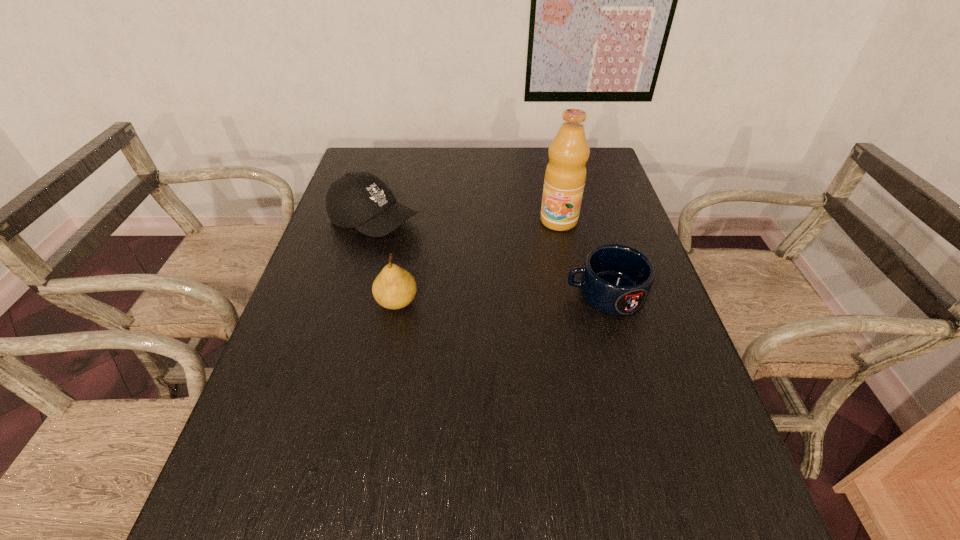
Image resolution: width=960 pixels, height=540 pixels. Identify the location of free space between the shortest object and the baseball cap. (490, 258).

Point out which object is positioned as the nearest to the baseball cap. Please provide its 2D coordinates. Your answer should be formatted as a tuple, i.e. [(x, y)], where the tuple contains the x and y coordinates of a point satisfying the conditions above.

[(394, 288)]

Locate which object is the third closest to the tallest object. Please provide its 2D coordinates. Your answer should be formatted as a tuple, i.e. [(x, y)], where the tuple contains the x and y coordinates of a point satisfying the conditions above.

[(394, 288)]

Find the location of `free space that satisfies the following two spatial constraints: 1. on the back side of the pear; 2. on the right side of the fruit juice`. free space that satisfies the following two spatial constraints: 1. on the back side of the pear; 2. on the right side of the fruit juice is located at coordinates (412, 221).

Locate an element on the screen. Image resolution: width=960 pixels, height=540 pixels. vacant space that satisfies the following two spatial constraints: 1. on the front side of the shortest object; 2. with the handle on the side of the fruit juice is located at coordinates (574, 294).

This screenshot has width=960, height=540. I want to click on free space that satisfies the following two spatial constraints: 1. on the back side of the baseball cap; 2. on the left side of the fruit juice, so click(x=374, y=221).